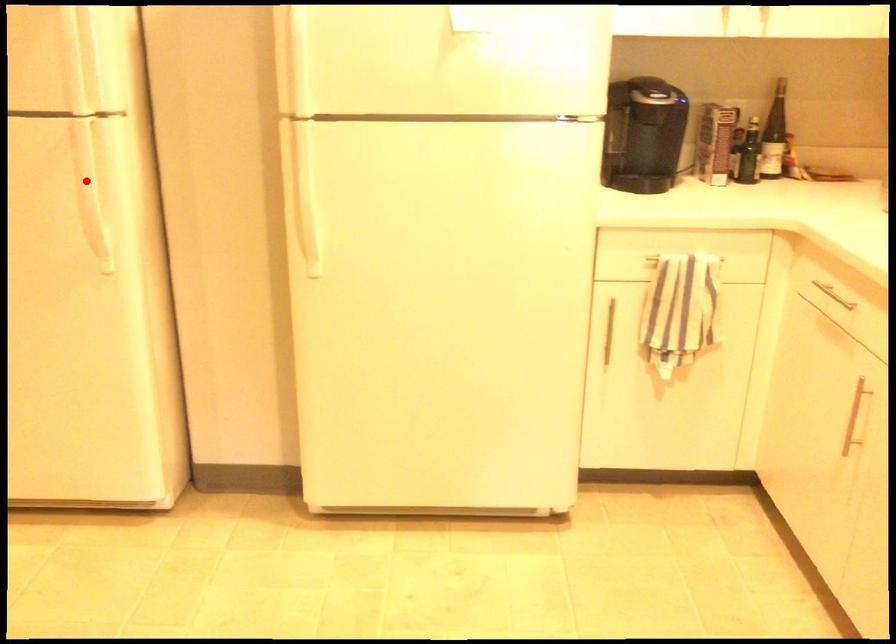
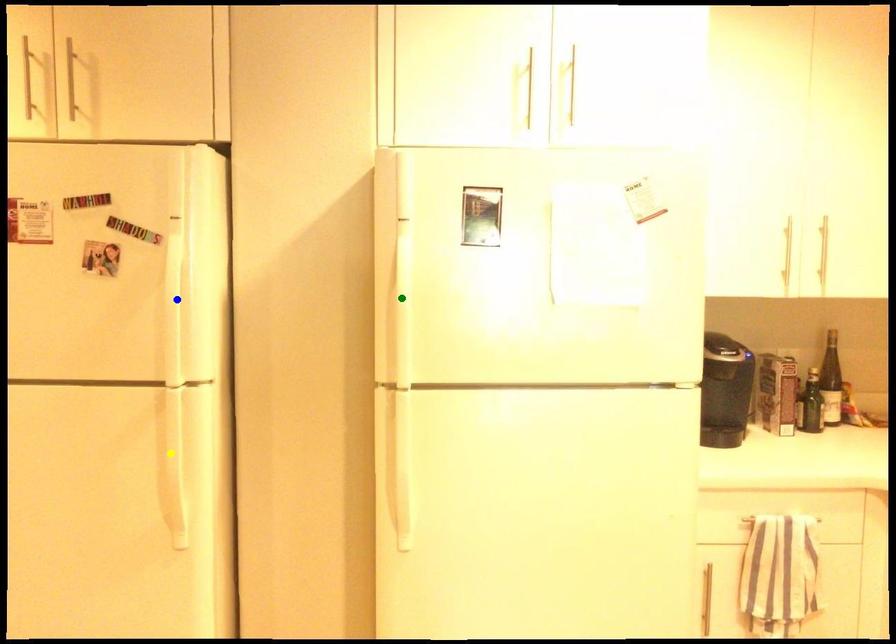
Question: I am providing you with two images of the same scene from different viewpoints. A red point is marked on the first image. You are given multiple points on the second image. Can you choose the point in image 2 that corresponds to the point in image 1?

Choices:
 (A) blue point
 (B) green point
 (C) yellow point

Answer: (C)